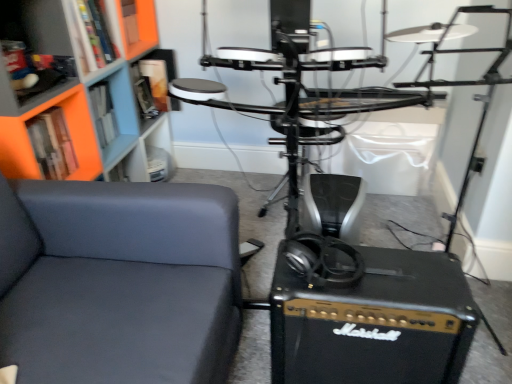
How much space does orange matte bookshelf at upper left, which is the third shelf in top-to-bottom order, occupy horizontally?

It is 3.28 inches.

The width and height of the screenshot is (512, 384). What are the coordinates of `matte black shelf at upper left, the 2th shelf viewed from the top` in the screenshot? It's located at (35, 26).

In order to click on orange matte bookshelf at upper left, which ranks as the 1th shelf in top-to-bottom order in this screenshot , I will do `click(94, 38)`.

Identify the location of orange matte bookshelf at upper left, which appears as the first shelf when ordered from the bottom. (69, 134).

Is the position of orange matte bookshelf at upper left, which is the third shelf from bottom to top, less distant than that of orange matte bookshelf at upper left, which appears as the first shelf when ordered from the bottom?

No, orange matte bookshelf at upper left, which is the third shelf from bottom to top, is further to the viewer.

Is orange matte bookshelf at upper left, which ranks as the 1th shelf in top-to-bottom order, oriented away from orange matte bookshelf at upper left, which is the third shelf in top-to-bottom order?

That's not correct — orange matte bookshelf at upper left, which ranks as the 1th shelf in top-to-bottom order, is not looking away from orange matte bookshelf at upper left, which is the third shelf in top-to-bottom order.

Which of these two, orange matte bookshelf at upper left, which is the third shelf from bottom to top, or orange matte bookshelf at upper left, which is the third shelf in top-to-bottom order, is thinner?

Thinner between the two is orange matte bookshelf at upper left, which is the third shelf in top-to-bottom order.

Considering the points (101, 6) and (83, 154), which point is in front, point (101, 6) or point (83, 154)?

The point (101, 6) is closer to the camera.

Considering the relative sizes of matte black shelf at upper left, arranged as the second shelf when ordered from the bottom, and orange matte bookshelf at upper left, which is the third shelf in top-to-bottom order, in the image provided, is matte black shelf at upper left, arranged as the second shelf when ordered from the bottom, wider than orange matte bookshelf at upper left, which is the third shelf in top-to-bottom order,?

Indeed, matte black shelf at upper left, arranged as the second shelf when ordered from the bottom, has a greater width compared to orange matte bookshelf at upper left, which is the third shelf in top-to-bottom order.

Locate an element on the screen. shelf on the left side of orange matte bookshelf at upper left, which is the third shelf in top-to-bottom order is located at coordinates (35, 26).

Which point is more forward, (9, 3) or (14, 163)?

The point (14, 163) is in front.

In the scene shown: Is the surface of matte black shelf at upper left, the 2th shelf viewed from the top, in direct contact with orange matte bookshelf at upper left, which is the third shelf in top-to-bottom order?

No, matte black shelf at upper left, the 2th shelf viewed from the top, is not making contact with orange matte bookshelf at upper left, which is the third shelf in top-to-bottom order.

Could you measure the distance between matte black shelf at upper left, the 2th shelf viewed from the top, and orange matte bookcase at upper left?

matte black shelf at upper left, the 2th shelf viewed from the top, is 5.33 inches away from orange matte bookcase at upper left.

Between matte black shelf at upper left, arranged as the second shelf when ordered from the bottom, and orange matte bookcase at upper left, which one has smaller width?

matte black shelf at upper left, arranged as the second shelf when ordered from the bottom.

Is matte black shelf at upper left, the 2th shelf viewed from the top, situated inside orange matte bookcase at upper left or outside?

matte black shelf at upper left, the 2th shelf viewed from the top, is contained in orange matte bookcase at upper left.

From a real-world perspective, relative to orange matte bookshelf at upper left, which ranks as the 1th shelf in top-to-bottom order, is orange matte bookcase at upper left vertically above or below?

orange matte bookcase at upper left is below orange matte bookshelf at upper left, which ranks as the 1th shelf in top-to-bottom order.

How different are the orientations of orange matte bookcase at upper left and orange matte bookshelf at upper left, which is the third shelf from bottom to top, in degrees?

They differ by 0.911 degrees in their facing directions.

Would you say orange matte bookcase at upper left is inside or outside orange matte bookshelf at upper left, which ranks as the 1th shelf in top-to-bottom order?

orange matte bookcase at upper left is outside orange matte bookshelf at upper left, which ranks as the 1th shelf in top-to-bottom order.

Based on the photo, considering the relative positions of orange matte bookshelf at upper left, which is the third shelf in top-to-bottom order, and matte black shelf at upper left, arranged as the second shelf when ordered from the bottom, in the image provided, is orange matte bookshelf at upper left, which is the third shelf in top-to-bottom order, to the left or to the right of matte black shelf at upper left, arranged as the second shelf when ordered from the bottom,?

Based on their positions, orange matte bookshelf at upper left, which is the third shelf in top-to-bottom order, is located to the right of matte black shelf at upper left, arranged as the second shelf when ordered from the bottom.

From a real-world perspective, does orange matte bookshelf at upper left, which appears as the first shelf when ordered from the bottom, stand above matte black shelf at upper left, arranged as the second shelf when ordered from the bottom?

No.

The width and height of the screenshot is (512, 384). What are the coordinates of `the 1st shelf behind the matte black shelf at upper left, arranged as the second shelf when ordered from the bottom, starting your count from the anchor` in the screenshot? It's located at (69, 134).

How far apart are orange matte bookshelf at upper left, which is the third shelf in top-to-bottom order, and matte black shelf at upper left, arranged as the second shelf when ordered from the bottom?

The distance of orange matte bookshelf at upper left, which is the third shelf in top-to-bottom order, from matte black shelf at upper left, arranged as the second shelf when ordered from the bottom, is 6.80 inches.

Is orange matte bookshelf at upper left, which is the third shelf from bottom to top, in contact with orange matte bookcase at upper left?

There is a gap between orange matte bookshelf at upper left, which is the third shelf from bottom to top, and orange matte bookcase at upper left.

Who is more distant, orange matte bookshelf at upper left, which ranks as the 1th shelf in top-to-bottom order, or orange matte bookcase at upper left?

Positioned behind is orange matte bookshelf at upper left, which ranks as the 1th shelf in top-to-bottom order.

Do you think orange matte bookshelf at upper left, which ranks as the 1th shelf in top-to-bottom order, is within orange matte bookcase at upper left, or outside of it?

orange matte bookshelf at upper left, which ranks as the 1th shelf in top-to-bottom order, is inside orange matte bookcase at upper left.

Considering the relative sizes of orange matte bookshelf at upper left, which ranks as the 1th shelf in top-to-bottom order, and orange matte bookcase at upper left in the image provided, is orange matte bookshelf at upper left, which ranks as the 1th shelf in top-to-bottom order, bigger than orange matte bookcase at upper left?

Incorrect, orange matte bookshelf at upper left, which ranks as the 1th shelf in top-to-bottom order, is not larger than orange matte bookcase at upper left.

Is matte gray chair at left oriented away from orange matte bookshelf at upper left, which is the third shelf from bottom to top?

No, matte gray chair at left is not facing away from orange matte bookshelf at upper left, which is the third shelf from bottom to top.

Considering the sizes of matte gray chair at left and orange matte bookshelf at upper left, which is the third shelf from bottom to top, in the image, is matte gray chair at left bigger or smaller than orange matte bookshelf at upper left, which is the third shelf from bottom to top,?

matte gray chair at left is bigger than orange matte bookshelf at upper left, which is the third shelf from bottom to top.

Are matte gray chair at left and orange matte bookshelf at upper left, which is the third shelf from bottom to top, far apart?

No.

What's the angular difference between matte gray chair at left and orange matte bookshelf at upper left, which is the third shelf from bottom to top,'s facing directions?

The angular difference between matte gray chair at left and orange matte bookshelf at upper left, which is the third shelf from bottom to top, is 1.83 degrees.

From the image's perspective, count 2nd shelfs downward from the orange matte bookshelf at upper left, which ranks as the 1th shelf in top-to-bottom order, and point to it. Please provide its 2D coordinates.

[(69, 134)]

From the matte black shelf at upper left, the 2th shelf viewed from the top, count 1st shelf to the right and point to it. Please provide its 2D coordinates.

[(69, 134)]

Estimate the real-world distances between objects in this image. Which object is further from orange matte bookcase at upper left, orange matte bookshelf at upper left, which ranks as the 1th shelf in top-to-bottom order, or orange matte bookshelf at upper left, which appears as the first shelf when ordered from the bottom?

orange matte bookshelf at upper left, which appears as the first shelf when ordered from the bottom.

Estimate the real-world distances between objects in this image. Which object is closer to matte black shelf at upper left, arranged as the second shelf when ordered from the bottom, matte gray chair at left or orange matte bookshelf at upper left, which appears as the first shelf when ordered from the bottom?

orange matte bookshelf at upper left, which appears as the first shelf when ordered from the bottom, is closer to matte black shelf at upper left, arranged as the second shelf when ordered from the bottom.

Considering their positions, is orange matte bookshelf at upper left, which ranks as the 1th shelf in top-to-bottom order, positioned further to matte black shelf at upper left, arranged as the second shelf when ordered from the bottom, than matte gray chair at left?

matte gray chair at left lies further to matte black shelf at upper left, arranged as the second shelf when ordered from the bottom, than the other object.

Consider the image. Looking at the image, which one is located further to matte gray chair at left, orange matte bookshelf at upper left, which is the third shelf in top-to-bottom order, or matte black shelf at upper left, arranged as the second shelf when ordered from the bottom?

Among the two, matte black shelf at upper left, arranged as the second shelf when ordered from the bottom, is located further to matte gray chair at left.

From the image, which object appears to be nearer to orange matte bookcase at upper left, orange matte bookshelf at upper left, which is the third shelf in top-to-bottom order, or matte gray chair at left?

Based on the image, orange matte bookshelf at upper left, which is the third shelf in top-to-bottom order, appears to be nearer to orange matte bookcase at upper left.

Considering their positions, is orange matte bookcase at upper left positioned further to orange matte bookshelf at upper left, which appears as the first shelf when ordered from the bottom, than orange matte bookshelf at upper left, which is the third shelf from bottom to top?

orange matte bookshelf at upper left, which is the third shelf from bottom to top, is further to orange matte bookshelf at upper left, which appears as the first shelf when ordered from the bottom.

Based on their spatial positions, is orange matte bookcase at upper left or orange matte bookshelf at upper left, which appears as the first shelf when ordered from the bottom, further from matte gray chair at left?

orange matte bookcase at upper left is further to matte gray chair at left.

Considering their positions, is matte gray chair at left positioned further to matte black shelf at upper left, the 2th shelf viewed from the top, than orange matte bookshelf at upper left, which is the third shelf from bottom to top?

matte gray chair at left.

At what (x,y) coordinates should I click in order to perform the action: click on bookcase between orange matte bookshelf at upper left, which ranks as the 1th shelf in top-to-bottom order, and orange matte bookshelf at upper left, which is the third shelf in top-to-bottom order, vertically. Please return your answer as a coordinate pair (x, y). This screenshot has width=512, height=384. Looking at the image, I should click on (82, 93).

This screenshot has height=384, width=512. I want to click on shelf that lies between orange matte bookshelf at upper left, which ranks as the 1th shelf in top-to-bottom order, and orange matte bookshelf at upper left, which is the third shelf in top-to-bottom order, from top to bottom, so click(x=35, y=26).

Find the location of a particular element. Image resolution: width=512 pixels, height=384 pixels. bookcase between matte gray chair at left and orange matte bookshelf at upper left, which appears as the first shelf when ordered from the bottom, in the front-back direction is located at coordinates (82, 93).

Locate an element on the screen. The image size is (512, 384). bookcase between matte black shelf at upper left, arranged as the second shelf when ordered from the bottom, and orange matte bookshelf at upper left, which appears as the first shelf when ordered from the bottom, vertically is located at coordinates (82, 93).